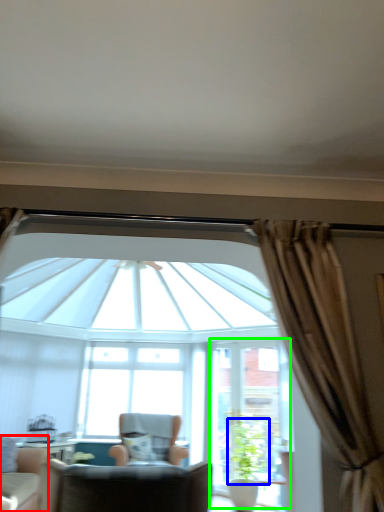
Question: Considering the real-world distances, which object is farthest from chair (highlighted by a red box)? plant (highlighted by a blue box) or screen door (highlighted by a green box)?

Choices:
 (A) plant
 (B) screen door

Answer: (A)